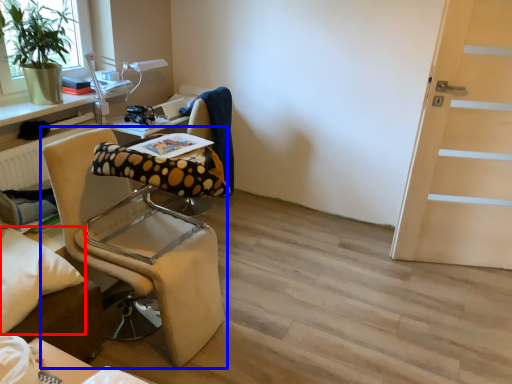
Question: Which object appears farthest to the camera in this image, pillow (highlighted by a red box) or chair (highlighted by a blue box)?

Choices:
 (A) pillow
 (B) chair

Answer: (B)